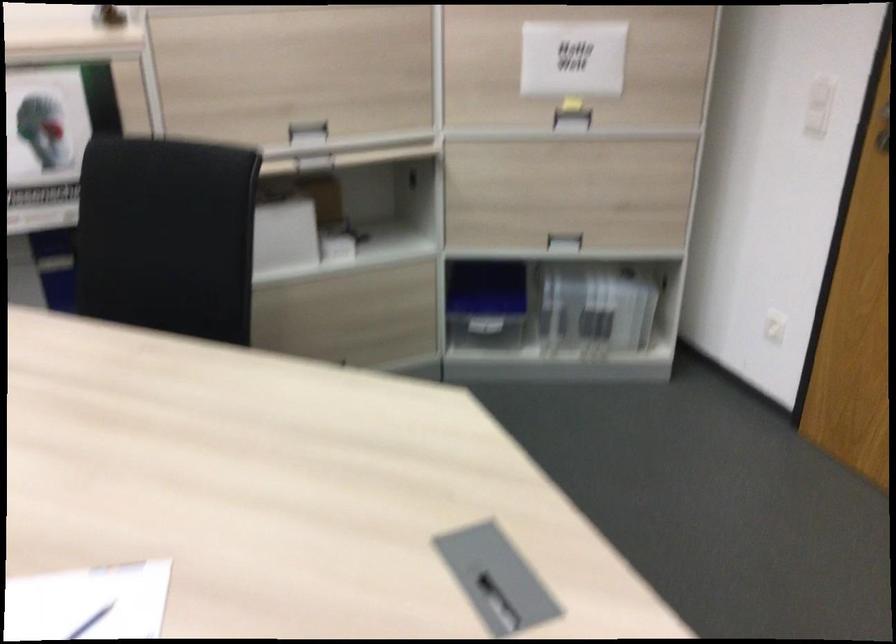
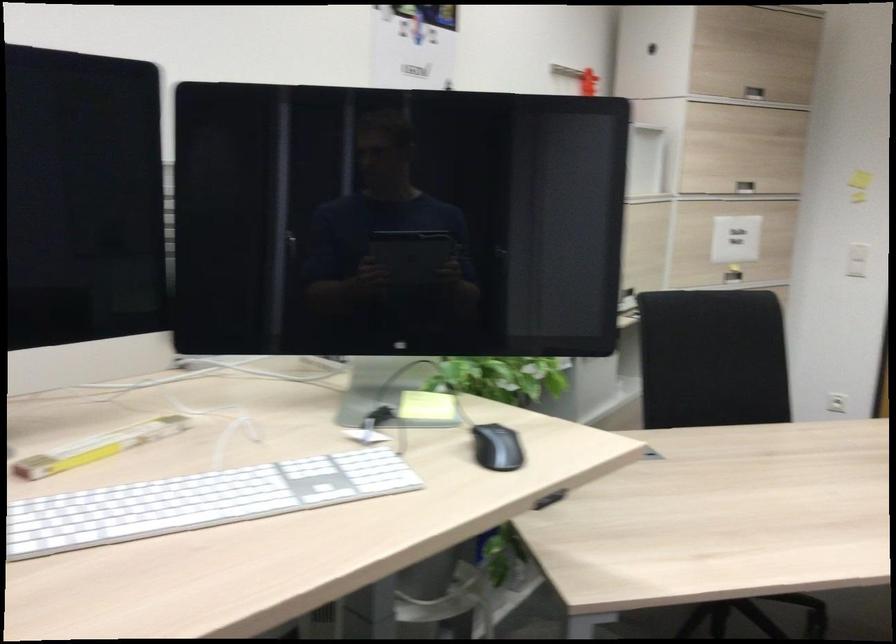
Question: I am providing you with two images of the same scene from different viewpoints. Which of the following objects are not visible in image2?

Choices:
 (A) yellow folding ruler
 (B) black cabinet handle
 (C) black computer mouse
 (D) black waste bin

Answer: (B)